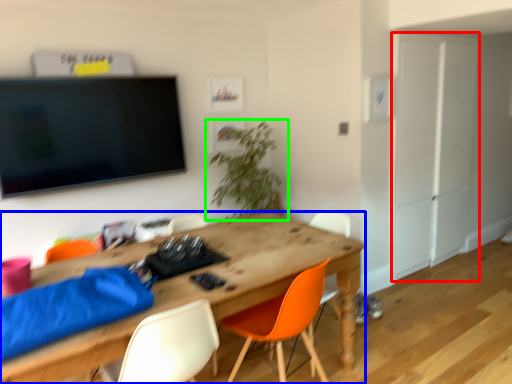
Question: Estimate the real-world distances between objects in this image. Which object is farther from armoire (highlighted by a red box), desk (highlighted by a blue box) or houseplant (highlighted by a green box)?

Choices:
 (A) desk
 (B) houseplant

Answer: (A)